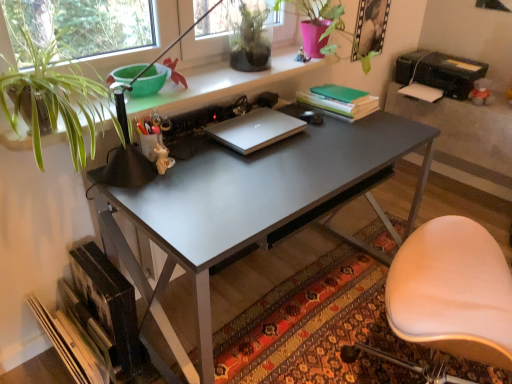
Question: From the image's perspective, is black plastic printer at upper right positioned above or below white leather chair at lower right?

Choices:
 (A) above
 (B) below

Answer: (A)

Question: Is black plastic printer at upper right wider or thinner than white leather chair at lower right?

Choices:
 (A) wide
 (B) thin

Answer: (B)

Question: Which object is positioned farthest from the matte gray desk at center?

Choices:
 (A) green matte plant at upper center, which appears as the second houseplant when viewed from the left
 (B) black plastic printer at upper right
 (C) white leather chair at lower right
 (D) matte white figurine at center
 (E) carpeted rug at lower center

Answer: (B)

Question: Estimate the real-world distances between objects in this image. Which object is farther from the silver metallic laptop at center?

Choices:
 (A) green matte plant at upper center, which appears as the 2th houseplant when ordered from the bottom
 (B) matte white figurine at center
 (C) matte gray desk at center
 (D) black plastic printer at upper right
 (E) white leather chair at lower right

Answer: (D)